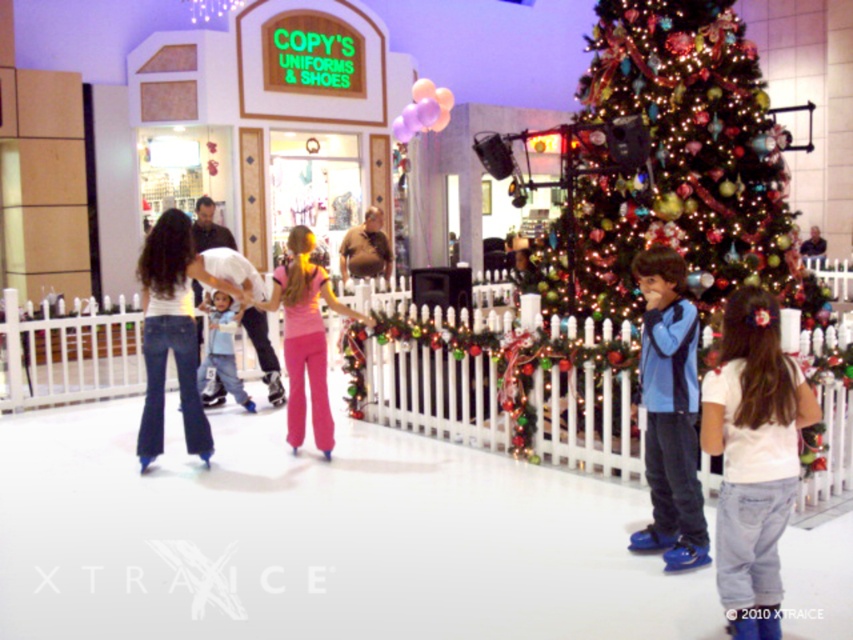
Is light blue fabric pants at center to the right of purple matte balloons at upper center from the viewer's perspective?

In fact, light blue fabric pants at center is to the left of purple matte balloons at upper center.

Does point (230, 314) lie in front of point (410, 134)?

Yes, point (230, 314) is closer to viewer.

The image size is (853, 640). Describe the element at coordinates (221, 352) in the screenshot. I see `light blue fabric pants at center` at that location.

At what (x,y) coordinates should I click in order to perform the action: click on light blue fabric pants at center. Please return your answer as a coordinate pair (x, y). The height and width of the screenshot is (640, 853). Looking at the image, I should click on (221, 352).

Is shiny green christmas tree at center to the right of denim jeans at center from the viewer's perspective?

Yes, shiny green christmas tree at center is to the right of denim jeans at center.

Is shiny green christmas tree at center below denim jeans at center?

No, shiny green christmas tree at center is not below denim jeans at center.

Between point (735, 33) and point (177, 275), which one is positioned in front?

Point (177, 275) is in front.

This screenshot has width=853, height=640. Identify the location of shiny green christmas tree at center. (677, 166).

Who is more distant from viewer, (161, 280) or (326, 280)?

Positioned behind is point (326, 280).

Does denim jeans at center have a lesser height compared to pink fabric pants at center?

No, denim jeans at center is not shorter than pink fabric pants at center.

What do you see at coordinates (172, 332) in the screenshot?
I see `denim jeans at center` at bounding box center [172, 332].

Image resolution: width=853 pixels, height=640 pixels. Find the location of `denim jeans at center`. denim jeans at center is located at coordinates (172, 332).